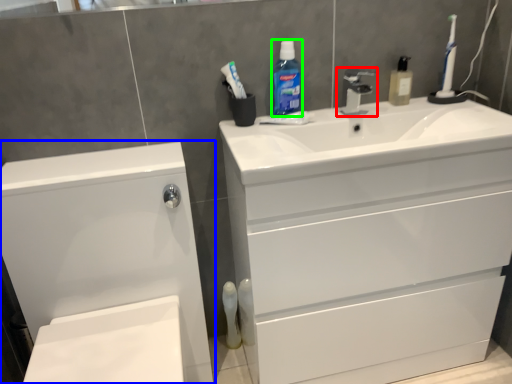
Question: Based on their relative distances, which object is nearer to tap (highlighted by a red box)? Choose from bathroom cabinet (highlighted by a blue box) and cleaning product (highlighted by a green box).

Choices:
 (A) bathroom cabinet
 (B) cleaning product

Answer: (B)